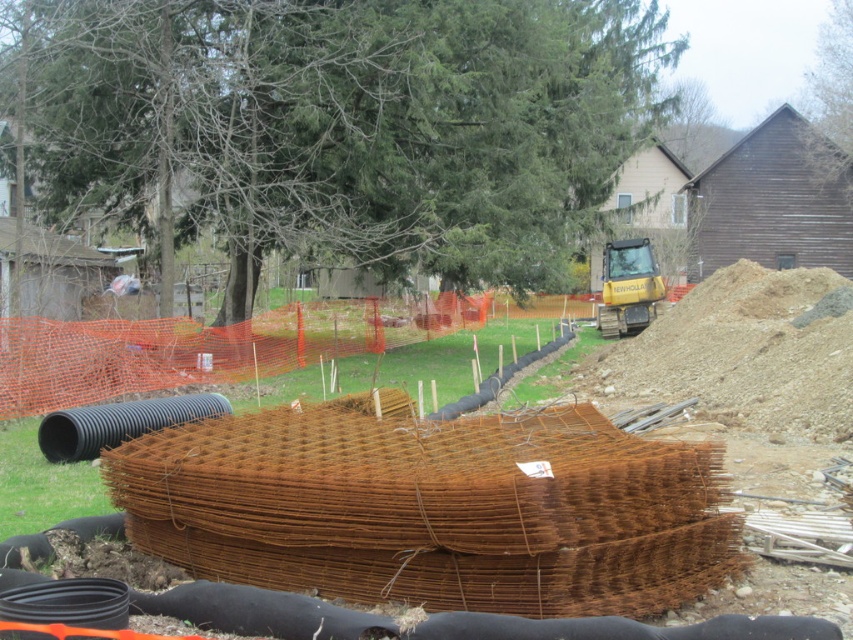
You are a construction worker standing at the point marked by the coordinates point [746,371]. Looking around, you see rusty wire mesh at center. What object is located exactly at your current position?

The point [746,371] corresponds to rusty wire mesh at center, so the object located exactly at your current position is the rusty wire mesh at center.